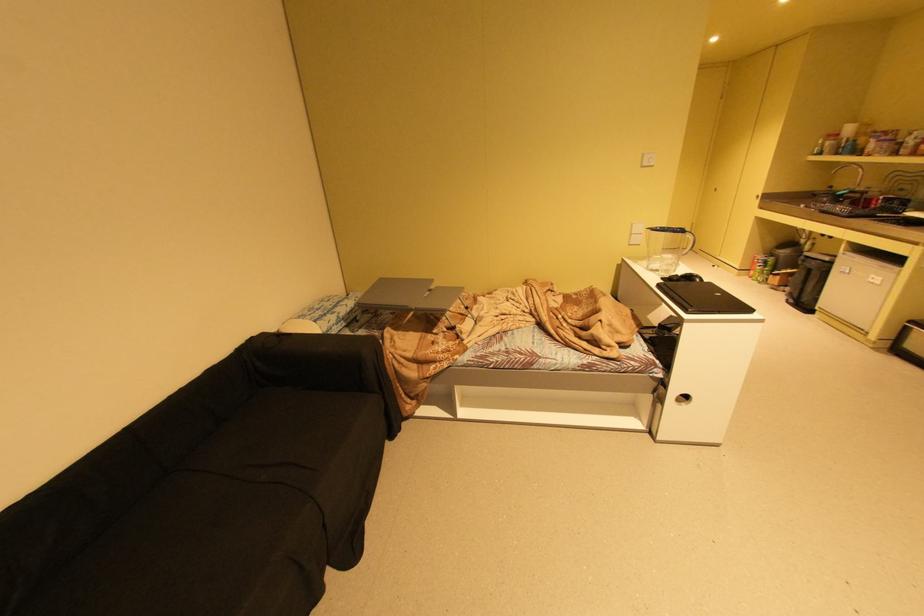
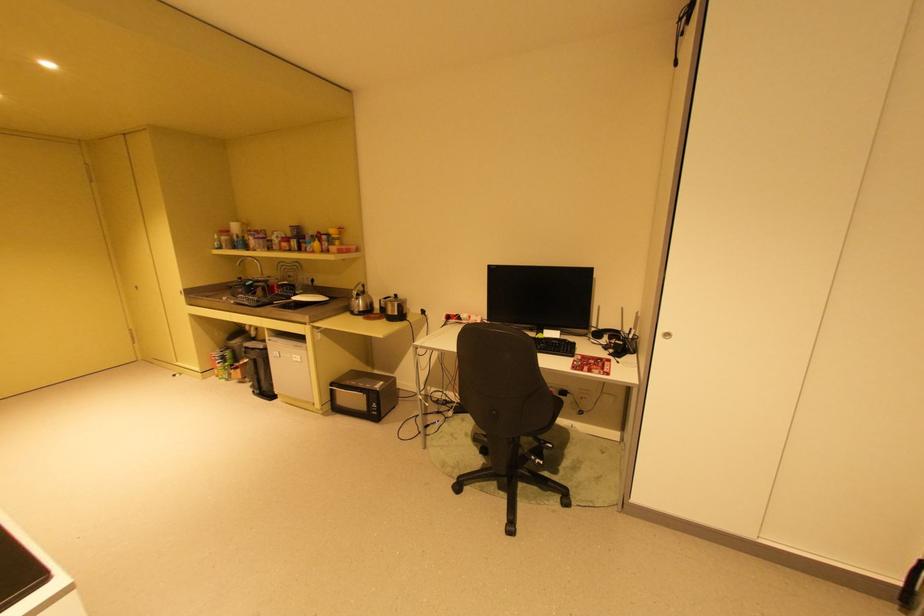
In the second image, find the point that corresponds to the point at 796,301 in the first image.

(261, 392)